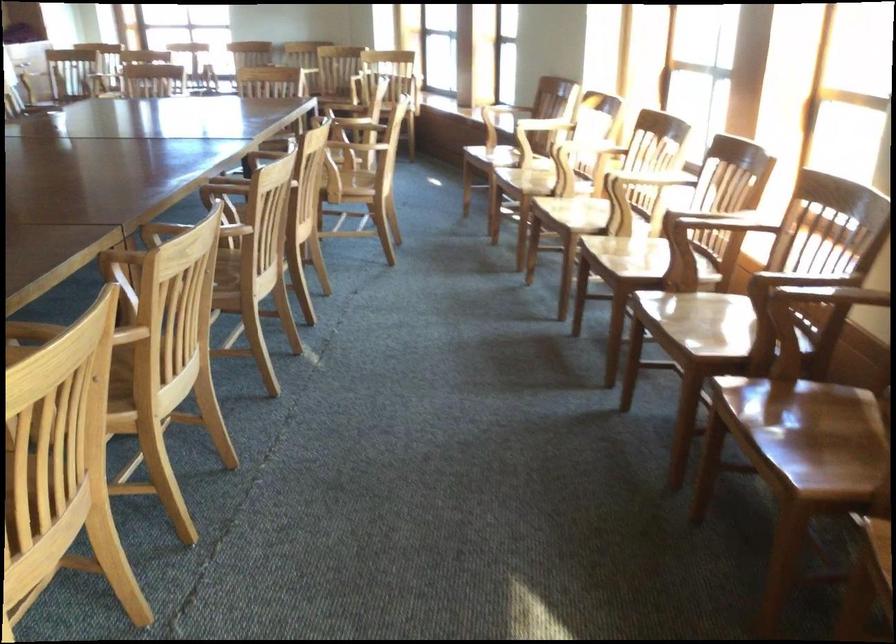
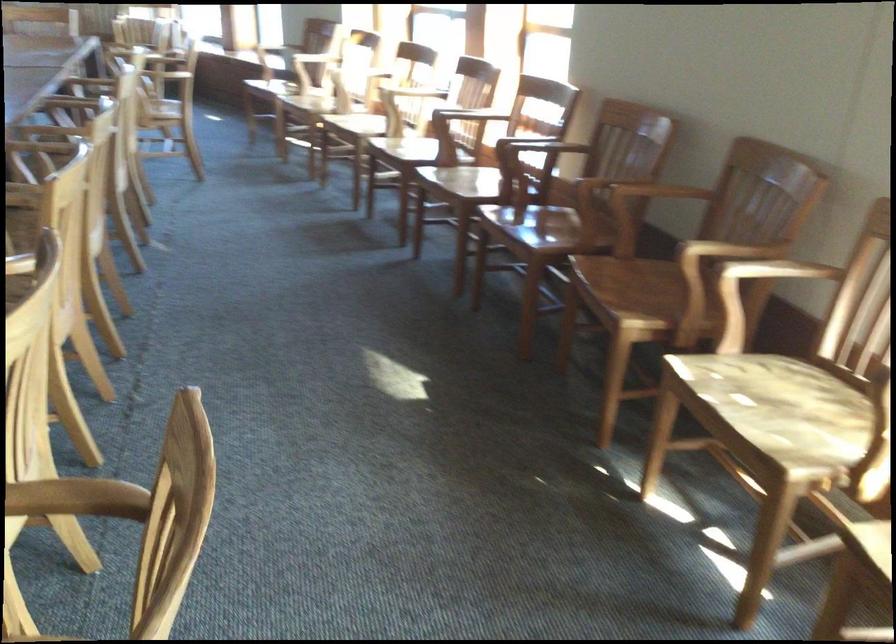
The point at (788, 444) is marked in the first image. Where is the corresponding point in the second image?

(531, 230)